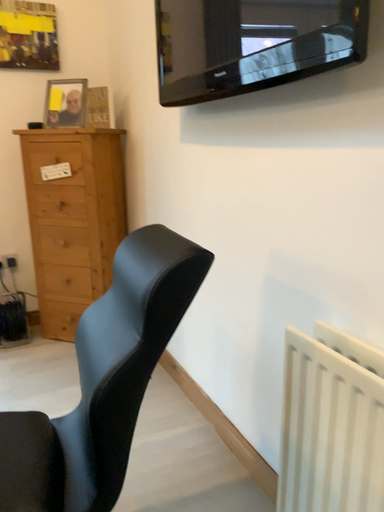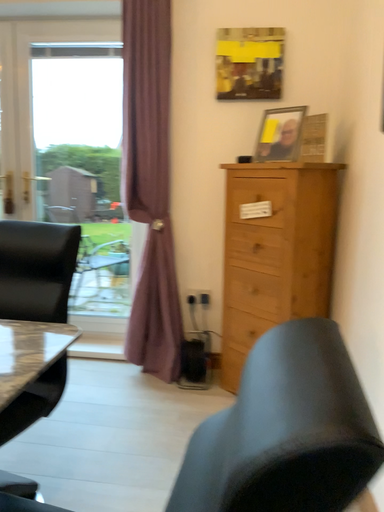
Question: Which way did the camera rotate in the video?

Choices:
 (A) rotated left
 (B) rotated right

Answer: (A)